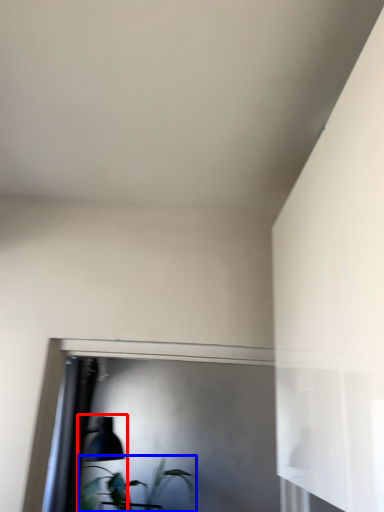
Question: Which object appears farthest to the camera in this image, table lamp (highlighted by a red box) or houseplant (highlighted by a blue box)?

Choices:
 (A) table lamp
 (B) houseplant

Answer: (B)